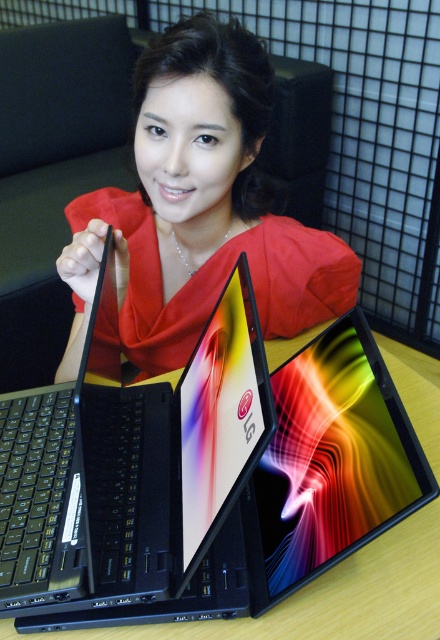
Question: Is black matte laptop at center thinner than matte red dress at center?

Choices:
 (A) no
 (B) yes

Answer: (B)

Question: Estimate the real-world distances between objects in this image. Which object is farther from the matte black tablet at center?

Choices:
 (A) matte red dress at center
 (B) black matte laptop at center

Answer: (A)

Question: Is black matte laptop at center bigger than matte black tablet at center?

Choices:
 (A) yes
 (B) no

Answer: (A)

Question: Does black matte laptop at center have a lesser width compared to matte black tablet at center?

Choices:
 (A) yes
 (B) no

Answer: (B)

Question: Which is farther from the black matte laptop at center?

Choices:
 (A) matte black tablet at center
 (B) matte red dress at center

Answer: (B)

Question: Estimate the real-world distances between objects in this image. Which object is farther from the matte black tablet at center?

Choices:
 (A) black matte laptop at center
 (B) matte red dress at center

Answer: (B)